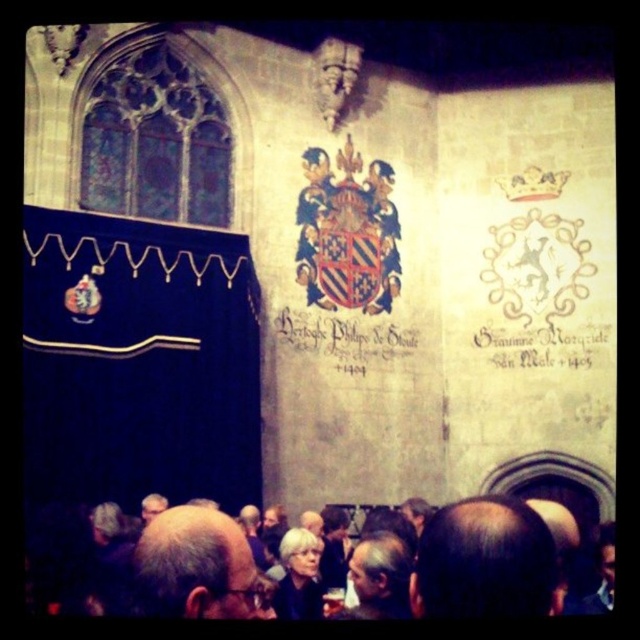
You are an artist standing in the room and want to sketch the gray hair at center and the black paper scroll at center. Which object should you focus on first if you want to start with the one closer to the left side of the wall?

The gray hair at center is to the left of the black paper scroll at center, so you should focus on the gray hair at center first since it is closer to the left side of the wall.